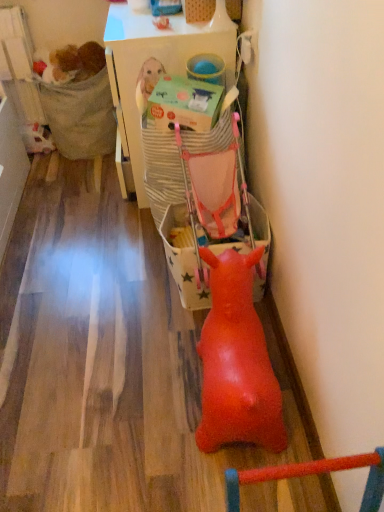
Question: Does rubber duck at center touch fuzzy brown stuffed animal at upper left?

Choices:
 (A) no
 (B) yes

Answer: (A)

Question: Is rubber duck at center positioned beyond the bounds of fuzzy brown stuffed animal at upper left?

Choices:
 (A) no
 (B) yes

Answer: (B)

Question: Can you confirm if rubber duck at center is wider than fuzzy brown stuffed animal at upper left?

Choices:
 (A) no
 (B) yes

Answer: (B)

Question: From a real-world perspective, is rubber duck at center physically above fuzzy brown stuffed animal at upper left?

Choices:
 (A) yes
 (B) no

Answer: (B)

Question: Does rubber duck at center have a lesser width compared to fuzzy brown stuffed animal at upper left?

Choices:
 (A) no
 (B) yes

Answer: (A)

Question: Relative to matte pink baby carriage at center, is matte green cardboard box at center in front or behind?

Choices:
 (A) behind
 (B) front

Answer: (B)

Question: Visually, is matte green cardboard box at center positioned to the left or to the right of matte pink baby carriage at center?

Choices:
 (A) right
 (B) left

Answer: (B)

Question: Is point (190, 118) closer or farther from the camera than point (213, 173)?

Choices:
 (A) closer
 (B) farther

Answer: (A)

Question: Looking at their shapes, would you say matte green cardboard box at center is wider or thinner than matte pink baby carriage at center?

Choices:
 (A) thin
 (B) wide

Answer: (A)

Question: In the image, is textured fabric chair at left on the left side or the right side of rubber duck at center?

Choices:
 (A) right
 (B) left

Answer: (B)

Question: Is textured fabric chair at left bigger or smaller than rubber duck at center?

Choices:
 (A) small
 (B) big

Answer: (A)

Question: Looking at their shapes, would you say textured fabric chair at left is wider or thinner than rubber duck at center?

Choices:
 (A) thin
 (B) wide

Answer: (B)

Question: Is point (104, 68) closer or farther from the camera than point (236, 393)?

Choices:
 (A) farther
 (B) closer

Answer: (A)

Question: From a real-world perspective, is matte green cardboard box at center positioned above or below white plastic table at upper center?

Choices:
 (A) above
 (B) below

Answer: (A)

Question: Do you think matte green cardboard box at center is within white plastic table at upper center, or outside of it?

Choices:
 (A) outside
 (B) inside

Answer: (A)